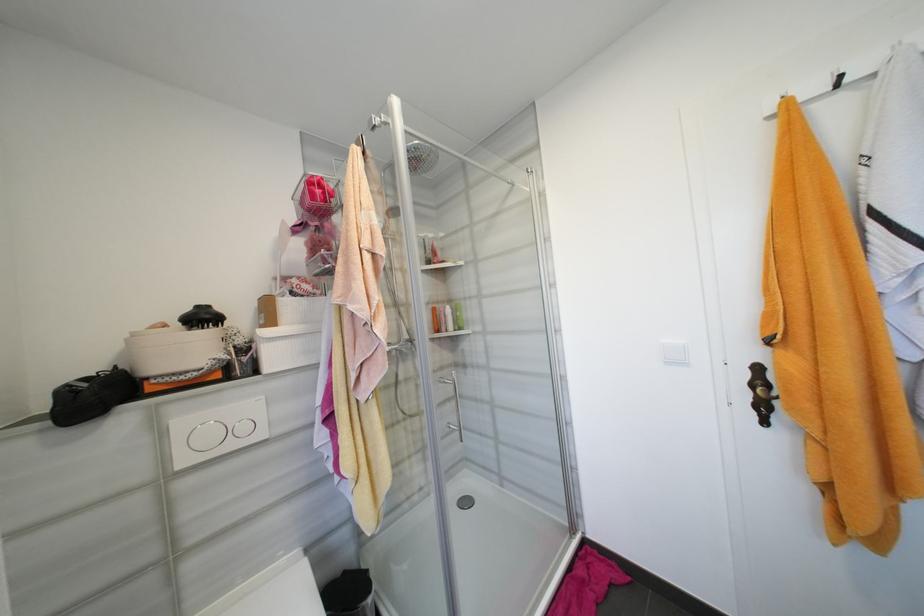
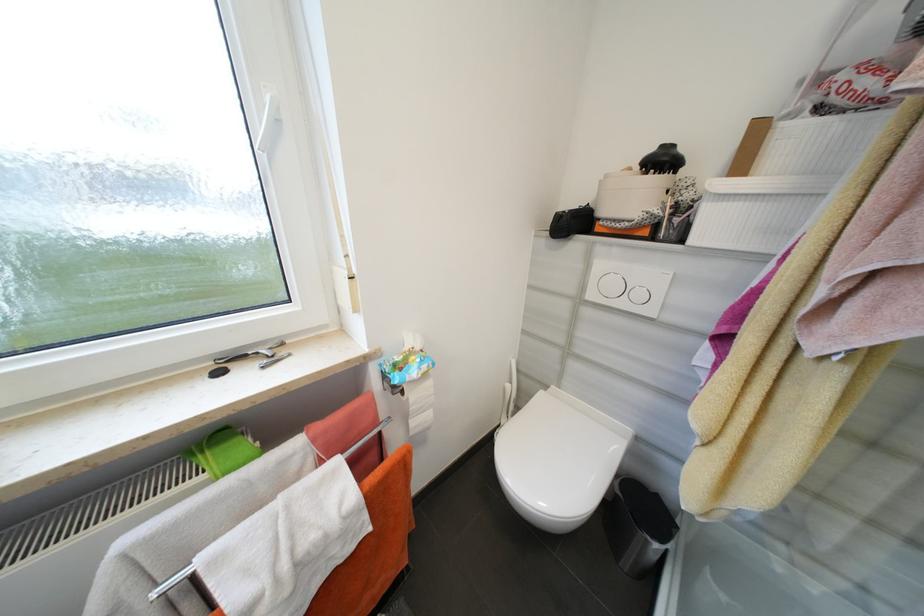
Where in the second image is the point corresponding to [232,358] from the first image?

(663, 213)